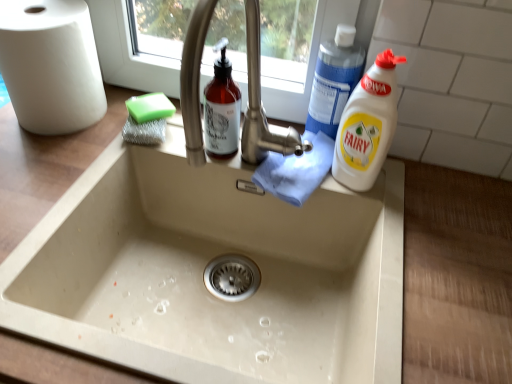
You are a GUI agent. You are given a task and a screenshot of the screen. Output one action in this format:
    pyautogui.click(x=<x>, y=<y>)
    Task: Click on the vacant space situated on the left part of green sponge at upper left
    
    Given the screenshot: What is the action you would take?
    pyautogui.click(x=76, y=132)